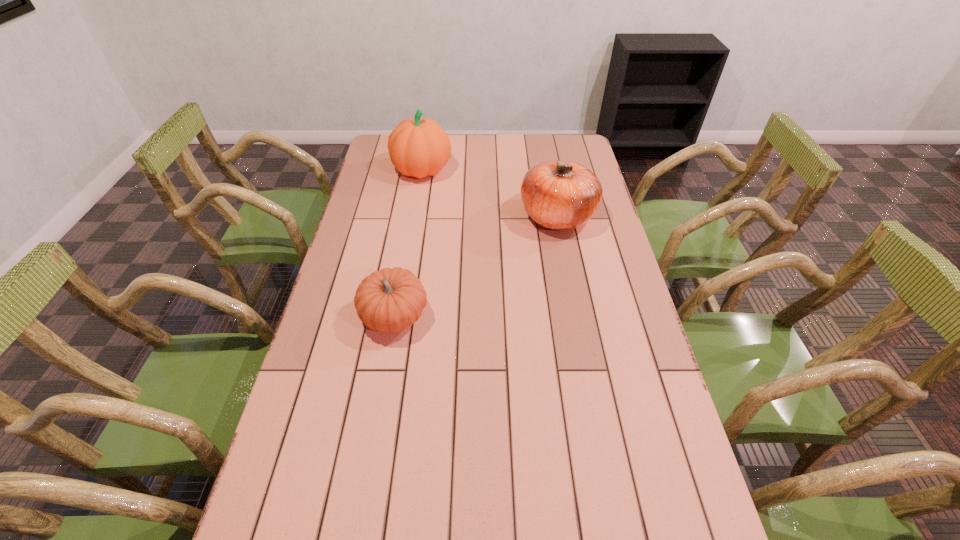
At what (x,y) coordinates should I click in order to perform the action: click on free point between the shortest object and the tallest object. Please return your answer as a coordinate pair (x, y). Looking at the image, I should click on (409, 243).

Where is `free point between the rightmost object and the farthest pumpkin`? free point between the rightmost object and the farthest pumpkin is located at coordinates (490, 193).

This screenshot has width=960, height=540. Find the location of `object that is the second closest to the rightmost object`. object that is the second closest to the rightmost object is located at coordinates (389, 300).

Locate which object is the second closest to the tallest pumpkin. Please provide its 2D coordinates. Your answer should be formatted as a tuple, i.e. [(x, y)], where the tuple contains the x and y coordinates of a point satisfying the conditions above.

[(389, 300)]

Point out which pumpkin is positioned as the second nearest to the farthest pumpkin. Please provide its 2D coordinates. Your answer should be formatted as a tuple, i.e. [(x, y)], where the tuple contains the x and y coordinates of a point satisfying the conditions above.

[(389, 300)]

What are the coordinates of `the second closest pumpkin to the farthest object` in the screenshot? It's located at (389, 300).

Locate an element on the screen. The width and height of the screenshot is (960, 540). vacant space that satisfies the following two spatial constraints: 1. on the back side of the tallest pumpkin; 2. on the right side of the nearest pumpkin is located at coordinates (420, 170).

Find the location of a particular element. The height and width of the screenshot is (540, 960). free region that satisfies the following two spatial constraints: 1. on the back side of the rightmost object; 2. on the left side of the shortest pumpkin is located at coordinates (412, 215).